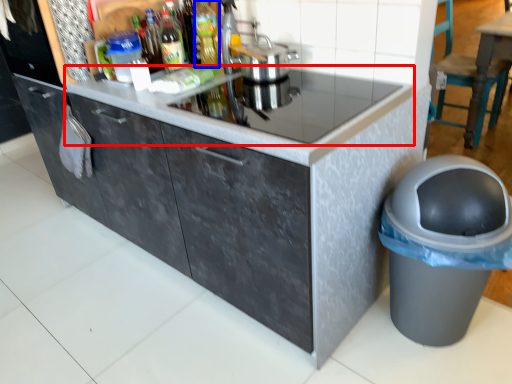
Question: Which object is further to the camera taking this photo, countertop (highlighted by a red box) or bottle (highlighted by a blue box)?

Choices:
 (A) countertop
 (B) bottle

Answer: (B)